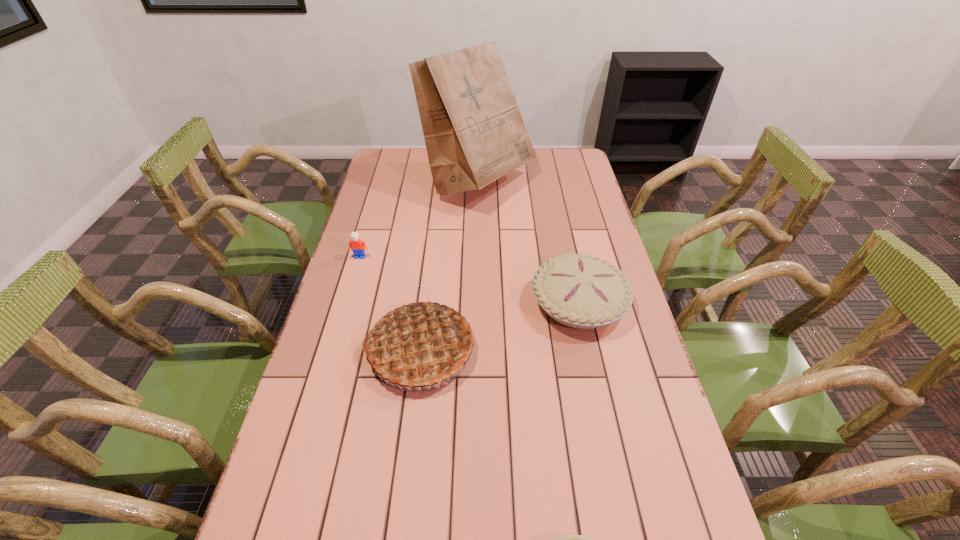
At what (x,y) coordinates should I click in order to perform the action: click on the tallest object. Please return your answer as a coordinate pair (x, y). Image resolution: width=960 pixels, height=540 pixels. Looking at the image, I should click on (474, 133).

Where is `grocery bag`? grocery bag is located at coordinates (474, 133).

The width and height of the screenshot is (960, 540). Identify the location of the tallest pie. (420, 345).

At what (x,y) coordinates should I click in order to perform the action: click on the leftmost pie. Please return your answer as a coordinate pair (x, y). The width and height of the screenshot is (960, 540). Looking at the image, I should click on (420, 345).

Where is `the second shortest pie`? the second shortest pie is located at coordinates (580, 291).

You are a GUI agent. You are given a task and a screenshot of the screen. Output one action in this format:
    pyautogui.click(x=<x>, y=<y>)
    Task: Click on the fourth nearest object
    The width and height of the screenshot is (960, 540).
    Given the screenshot: What is the action you would take?
    pyautogui.click(x=356, y=245)

Image resolution: width=960 pixels, height=540 pixels. I want to click on the leftmost object, so click(x=356, y=245).

Identify the location of vacant position located on the right of the tallest object. Image resolution: width=960 pixels, height=540 pixels. (552, 180).

This screenshot has width=960, height=540. Find the location of `free space located on the back of the second tallest object`. free space located on the back of the second tallest object is located at coordinates (432, 250).

Find the location of a particular element. This screenshot has height=540, width=960. free space located on the left of the second tallest pie is located at coordinates tap(431, 302).